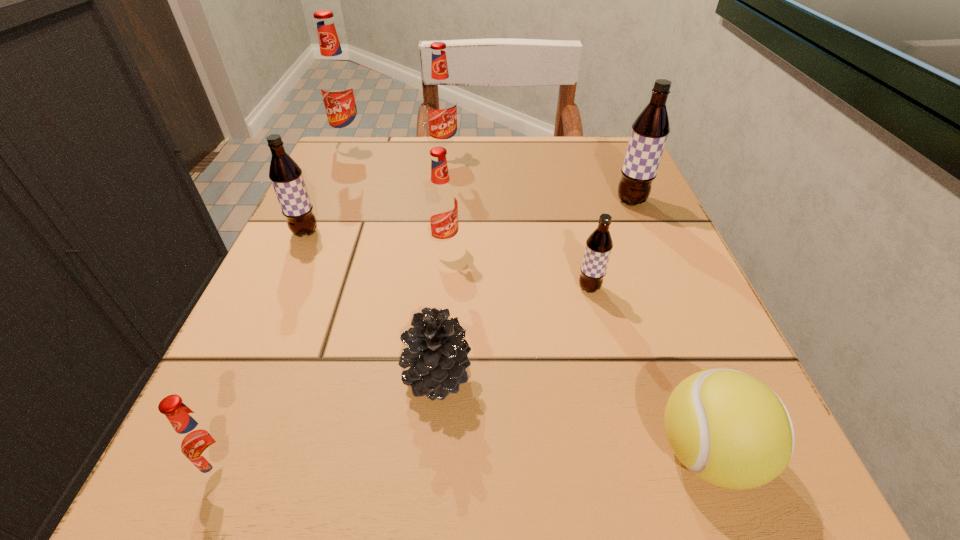
The height and width of the screenshot is (540, 960). I want to click on free space between the seventh nearest object and the tennis ball, so click(668, 327).

The image size is (960, 540). Find the location of `free spot between the leftmost brown root beer and the seventh nearest object`. free spot between the leftmost brown root beer and the seventh nearest object is located at coordinates (468, 217).

The width and height of the screenshot is (960, 540). I want to click on vacant space that is in between the second nearest brown root beer and the yellow tennis ball, so (506, 342).

At what (x,y) coordinates should I click in order to perform the action: click on empty location between the second biggest brown root beer and the third smallest red root beer. Please return your answer as a coordinate pair (x, y). The width and height of the screenshot is (960, 540). Looking at the image, I should click on (375, 192).

Where is `unoccupied area between the smallest red root beer and the pinecone`? Image resolution: width=960 pixels, height=540 pixels. unoccupied area between the smallest red root beer and the pinecone is located at coordinates (332, 422).

This screenshot has width=960, height=540. I want to click on the second closest object to the second biggest red root beer, so click(x=442, y=206).

You are a GUI agent. You are given a task and a screenshot of the screen. Output one action in this format:
    pyautogui.click(x=<x>, y=<y>)
    Task: Click on the object identified as the fourth closest to the second smallest brown root beer
    
    Given the screenshot: What is the action you would take?
    pyautogui.click(x=441, y=101)

The image size is (960, 540). Identify the location of root beer that is the fourth nearest to the nearest brown root beer. (286, 176).

This screenshot has height=540, width=960. Find the location of `root beer that is the fourth closest to the brown pinecone`. root beer that is the fourth closest to the brown pinecone is located at coordinates (286, 176).

Image resolution: width=960 pixels, height=540 pixels. I want to click on red root beer that stands as the second closest to the second smallest red root beer, so click(338, 86).